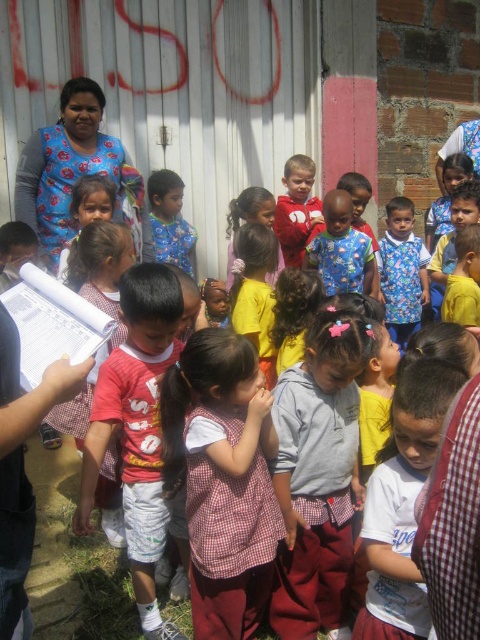
You are a photographer trying to capture a group photo of the children. Since you want to ensure everyone fits in the frame, you need to know which clothing item takes up more horizontal space. Which is wider, the checkered fabric dress at center or the red cotton shirt at center?

The checkered fabric dress at center is wider than the red cotton shirt at center according to the description.

You are a photographer trying to capture both the checkered fabric dress at center and the red cotton shirt at center in the same frame. Which clothing item should you focus on first to ensure both are in the frame?

The checkered fabric dress at center is smaller than the red cotton shirt at center, so you should focus on the checkered fabric dress at center first to ensure both are in the frame.

You are a photographer trying to capture a photo of the children near the metal wall. You notice two points marked on your viewfinder at coordinates point (245, 468) and point (152, 348). Which point is closer to the camera?

Point (245, 468) is in front of point (152, 348), so it is closer to the camera.